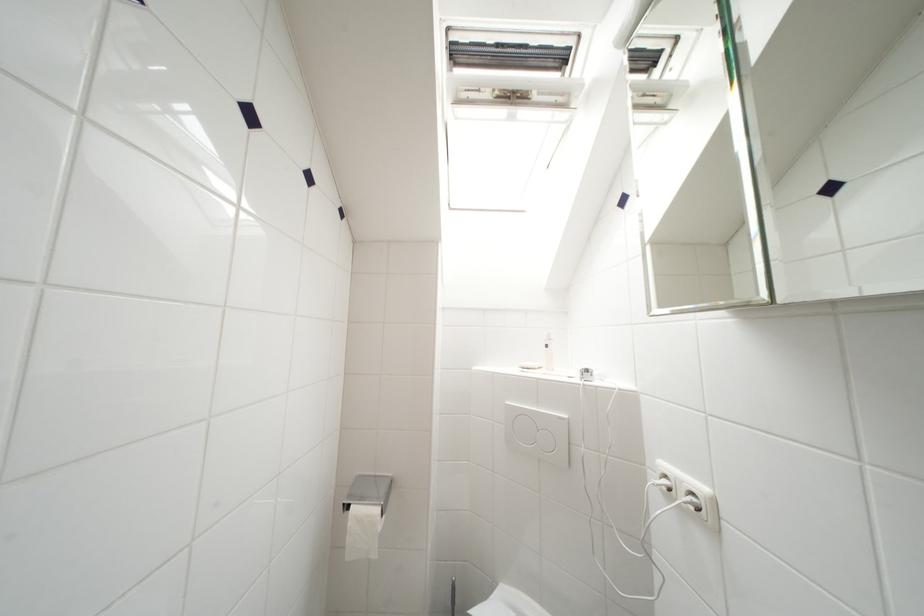
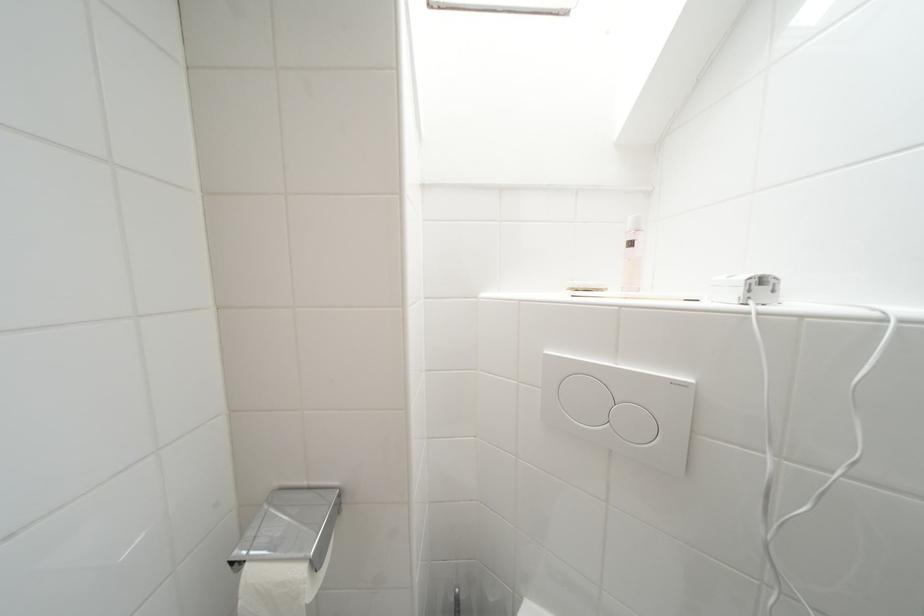
The point at [553,350] is marked in the first image. Where is the corresponding point in the second image?

(638, 246)